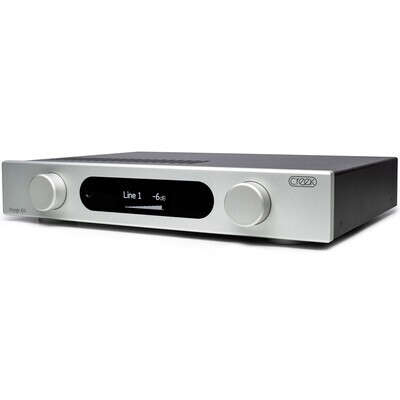
This screenshot has height=400, width=400. I want to click on led text, so click(x=135, y=196), click(x=161, y=194).